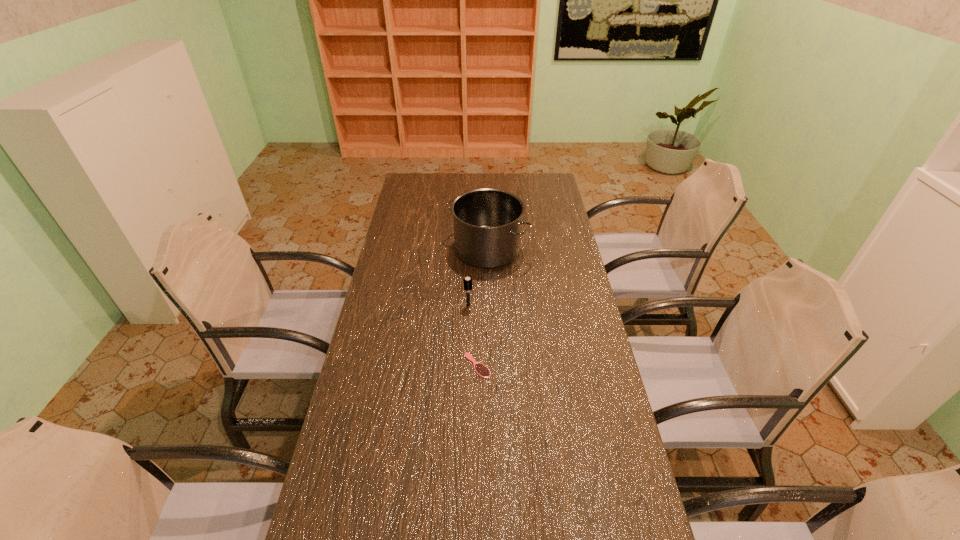
What are the coordinates of `free location at the left edge` in the screenshot? It's located at point(400,353).

Where is `free space at the right edge of the desktop`? This screenshot has width=960, height=540. free space at the right edge of the desktop is located at coordinates point(553,334).

Find the location of a particular element. vacant space at the far left corner of the desktop is located at coordinates (416, 180).

Locate an element on the screen. Image resolution: width=960 pixels, height=540 pixels. vacant region at the far right corner of the desktop is located at coordinates (536, 196).

Locate an element on the screen. This screenshot has height=540, width=960. vacant area between the nearer hairbrush and the farthest object is located at coordinates (482, 308).

You are a GUI agent. You are given a task and a screenshot of the screen. Output one action in this format:
    pyautogui.click(x=<x>, y=<y>)
    Task: Click on the free space between the farthest object and the shorter hairbrush
    
    Given the screenshot: What is the action you would take?
    pyautogui.click(x=482, y=308)

Where is `unoccupied position between the nearer hairbrush and the second shortest object`? This screenshot has height=540, width=960. unoccupied position between the nearer hairbrush and the second shortest object is located at coordinates (473, 335).

Where is `empty space that is in between the nearest object and the farther hairbrush`? The width and height of the screenshot is (960, 540). empty space that is in between the nearest object and the farther hairbrush is located at coordinates (473, 335).

The image size is (960, 540). What are the coordinates of `vacant space that's between the saucepan and the taller hairbrush` in the screenshot? It's located at [x=478, y=278].

Where is `vacant area between the saucepan and the shortest object`? This screenshot has width=960, height=540. vacant area between the saucepan and the shortest object is located at coordinates (482, 308).